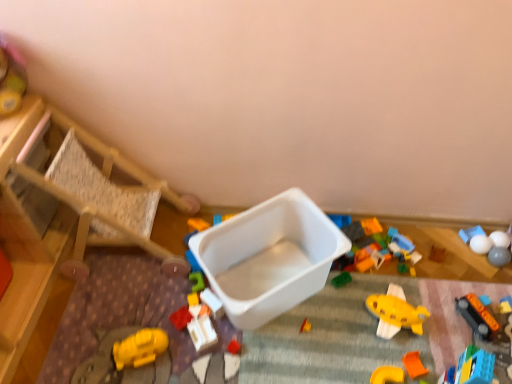
Question: Is orange matte block at lower right, placed as the seventh toy when sorted from right to left, outside white matte ball at upper right, the third toy when ordered from right to left?

Choices:
 (A) yes
 (B) no

Answer: (A)

Question: Does orange matte block at lower right, arranged as the eighth toy when viewed from the left, turn towards white matte ball at upper right, the third toy when ordered from right to left?

Choices:
 (A) no
 (B) yes

Answer: (A)

Question: Is orange matte block at lower right, arranged as the eighth toy when viewed from the left, smaller than white matte ball at upper right, the third toy when ordered from right to left?

Choices:
 (A) no
 (B) yes

Answer: (B)

Question: Is orange matte block at lower right, arranged as the eighth toy when viewed from the left, looking in the opposite direction of white matte ball at upper right, which is the twelfth toy from left to right?

Choices:
 (A) no
 (B) yes

Answer: (A)

Question: Are orange matte block at lower right, placed as the seventh toy when sorted from right to left, and white matte ball at upper right, the third toy when ordered from right to left, beside each other?

Choices:
 (A) no
 (B) yes

Answer: (A)

Question: From the image's perspective, relative to orange plastic train at lower right, which is the 5th toy in right-to-left order, is smooth plastic container at upper left, which ranks as the 1th toy in left-to-right order, above or below?

Choices:
 (A) below
 (B) above

Answer: (B)

Question: Is smooth plastic container at upper left, which ranks as the 1th toy in left-to-right order, wider or thinner than orange plastic train at lower right, the tenth toy in the left-to-right sequence?

Choices:
 (A) thin
 (B) wide

Answer: (B)

Question: In terms of size, does smooth plastic container at upper left, positioned as the fourteenth toy in right-to-left order, appear bigger or smaller than orange plastic train at lower right, which is the 5th toy in right-to-left order?

Choices:
 (A) small
 (B) big

Answer: (B)

Question: Is smooth plastic container at upper left, positioned as the fourteenth toy in right-to-left order, inside or outside of orange plastic train at lower right, which is the 5th toy in right-to-left order?

Choices:
 (A) outside
 (B) inside

Answer: (A)

Question: Is rubberized plastic blocks at center, which is counted as the sixth toy, starting from the left, wider or thinner than orange plastic train at lower right, the tenth toy in the left-to-right sequence?

Choices:
 (A) wide
 (B) thin

Answer: (B)

Question: Is rubberized plastic blocks at center, which is counted as the sixth toy, starting from the left, bigger or smaller than orange plastic train at lower right, the tenth toy in the left-to-right sequence?

Choices:
 (A) small
 (B) big

Answer: (A)

Question: In terms of height, does rubberized plastic blocks at center, which is counted as the sixth toy, starting from the left, look taller or shorter compared to orange plastic train at lower right, the tenth toy in the left-to-right sequence?

Choices:
 (A) short
 (B) tall

Answer: (A)

Question: Based on their positions, is rubberized plastic blocks at center, which is the 9th toy in right-to-left order, located to the left or right of orange plastic train at lower right, the tenth toy in the left-to-right sequence?

Choices:
 (A) right
 (B) left

Answer: (B)

Question: Based on their sizes in the image, would you say blue plastic toy at center, the 11th toy in the right-to-left sequence, is bigger or smaller than yellow matte airplane at center, which appears as the 7th toy when viewed from the left?

Choices:
 (A) big
 (B) small

Answer: (B)

Question: Visually, is blue plastic toy at center, the fourth toy from the left, positioned to the left or to the right of yellow matte airplane at center, placed as the eighth toy when sorted from right to left?

Choices:
 (A) right
 (B) left

Answer: (B)